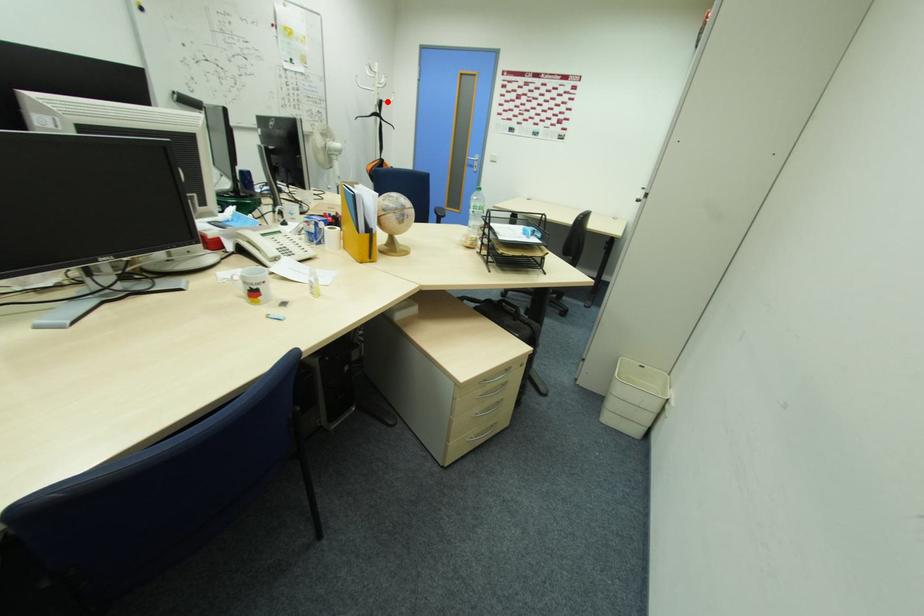
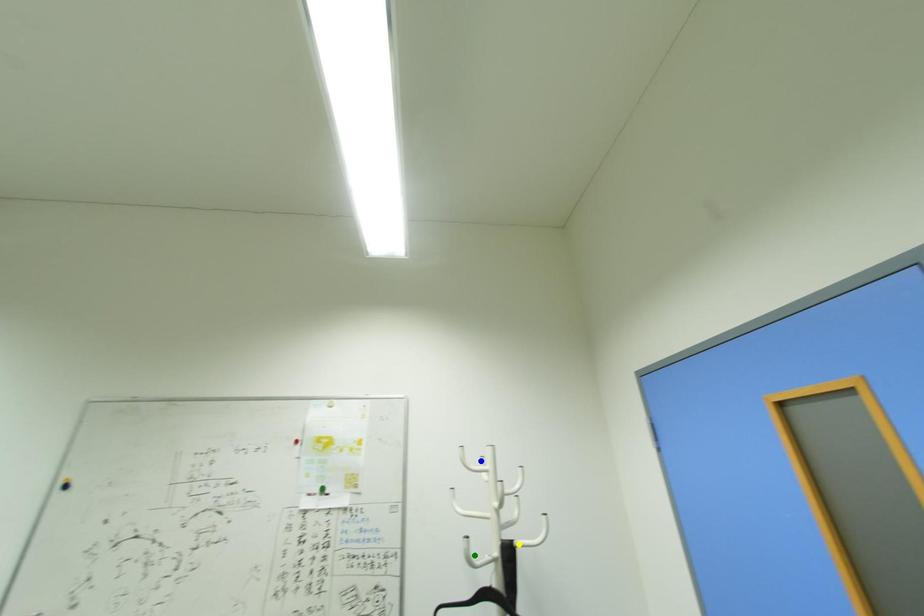
Question: I am providing you with two images of the same scene from different viewpoints. A red point is marked on the first image. You are given multiple points on the second image. Can you choose the point in image 2 that corresponds to the point in image 1?

Choices:
 (A) green point
 (B) blue point
 (C) yellow point

Answer: (C)